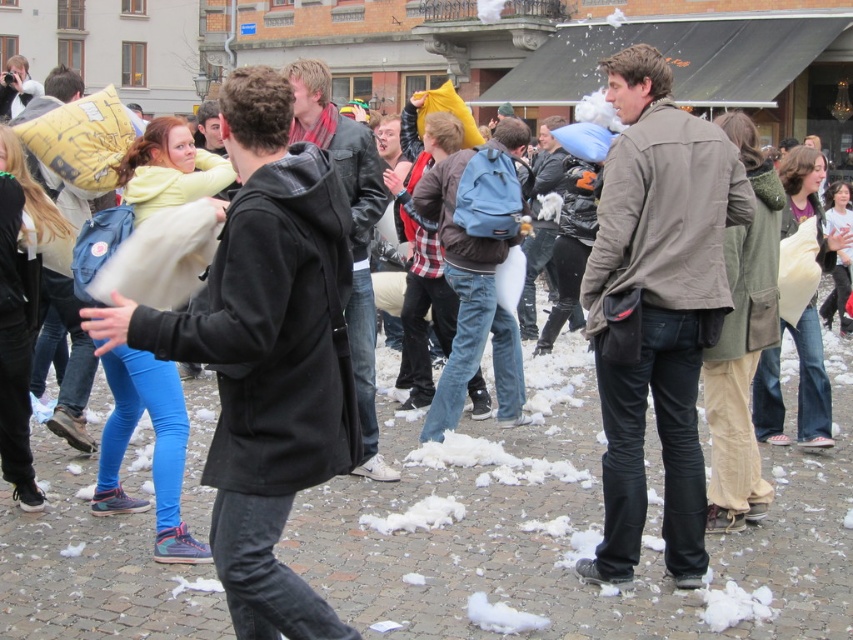
You are organizing a pillow fight and need to ensure that the matte yellow pillow at left can fit through a doorway that is currently occupied by the dark brown leather jacket at center. Based on their sizes, will the pillow pass through without needing to move the jacket?

The matte yellow pillow at left might be wider than the dark brown leather jacket at center, so there is a possibility that the pillow cannot pass through the doorway without adjusting the jacket.

You are a photographer trying to capture a shot of the matte yellow pillow at left and the dark brown leather jacket at center. Based on their sizes in the image, which object would appear smaller in your photo?

The matte yellow pillow at left appears smaller in the photo because it is shorter than the dark brown leather jacket at center.

You are a photographer trying to capture the action of the pillow fight. You notice the black matte jacket at center and the matte yellow pillow at left. Based on their positions, which object is positioned to the left?

The matte yellow pillow at left is positioned to the left of the black matte jacket at center.